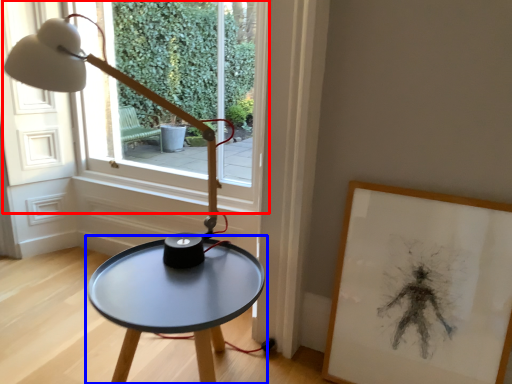
Question: Which object appears closest to the camera in this image, window (highlighted by a red box) or table (highlighted by a blue box)?

Choices:
 (A) window
 (B) table

Answer: (B)